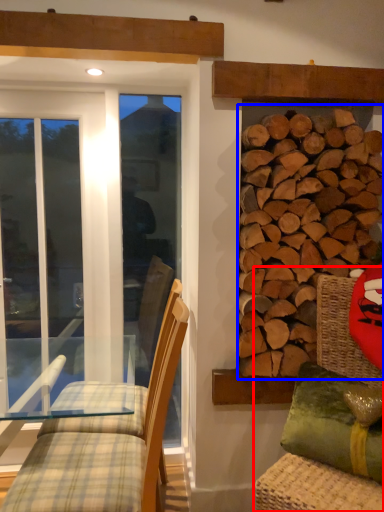
Question: Which object appears farthest to the camera in this image, swivel chair (highlighted by a red box) or hardwood (highlighted by a blue box)?

Choices:
 (A) swivel chair
 (B) hardwood

Answer: (B)